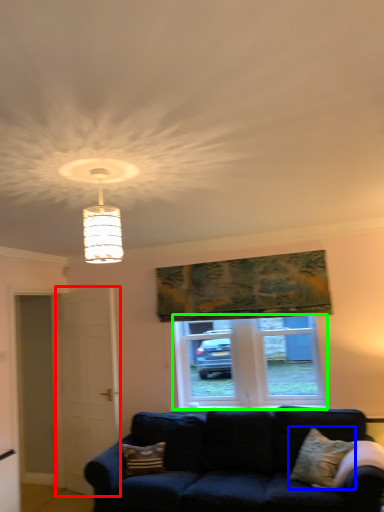
Question: Considering the real-world distances, which object is farthest from screen door (highlighted by a red box)? pillow (highlighted by a blue box) or window (highlighted by a green box)?

Choices:
 (A) pillow
 (B) window

Answer: (A)